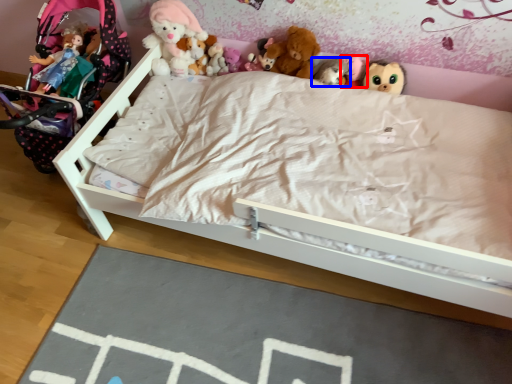
Question: Among these objects, which one is nearest to the camera, toy (highlighted by a red box) or toy (highlighted by a blue box)?

Choices:
 (A) toy
 (B) toy

Answer: (B)